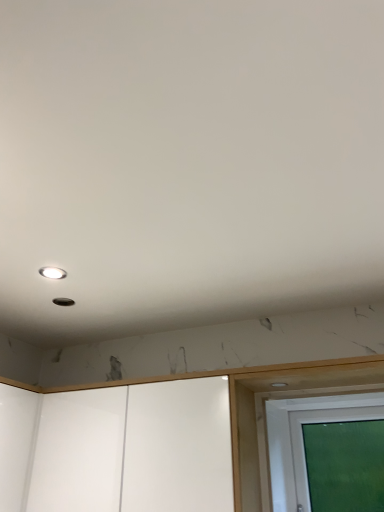
Question: Looking at their shapes, would you say transparent glass screen door at lower right, the 2th screen door in the left-to-right sequence, is wider or thinner than matte white droplight at upper left?

Choices:
 (A) thin
 (B) wide

Answer: (B)

Question: Is transparent glass screen door at lower right, which is the 1th screen door in right-to-left order, to the left or to the right of matte white droplight at upper left in the image?

Choices:
 (A) left
 (B) right

Answer: (B)

Question: Which is nearer to the matte white droplight at upper left?

Choices:
 (A) white glossy cabinet at lower center, acting as the 2th screen door starting from the right
 (B) transparent glass screen door at lower right, which is the 1th screen door in right-to-left order

Answer: (A)

Question: Which object is positioned closest to the white glossy cabinet at lower center, acting as the 2th screen door starting from the right?

Choices:
 (A) transparent glass screen door at lower right, the 2th screen door in the left-to-right sequence
 (B) matte white droplight at upper left

Answer: (A)